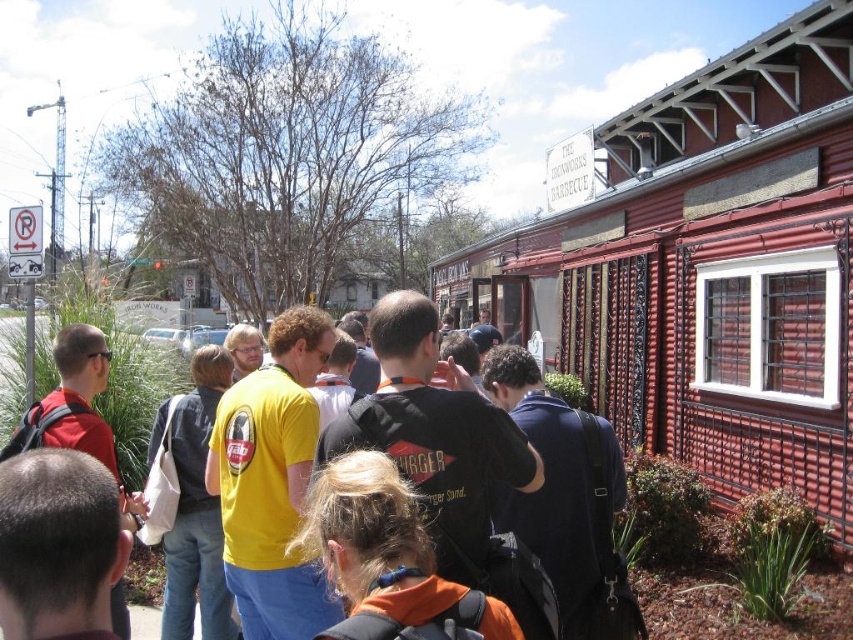
Question: Is black backpack at center above orange fabric backpack at center?

Choices:
 (A) yes
 (B) no

Answer: (A)

Question: Does black backpack at center have a larger size compared to orange fabric backpack at center?

Choices:
 (A) yes
 (B) no

Answer: (A)

Question: Which point is closer to the camera?

Choices:
 (A) black backpack at center
 (B) orange fabric backpack at center

Answer: (B)

Question: Does black backpack at center appear under orange fabric backpack at center?

Choices:
 (A) yes
 (B) no

Answer: (B)

Question: Which of the following is the farthest from the observer?

Choices:
 (A) orange fabric backpack at center
 (B) black backpack at center

Answer: (B)

Question: Which of the following is the closest to the observer?

Choices:
 (A) orange fabric backpack at center
 (B) black backpack at center

Answer: (A)